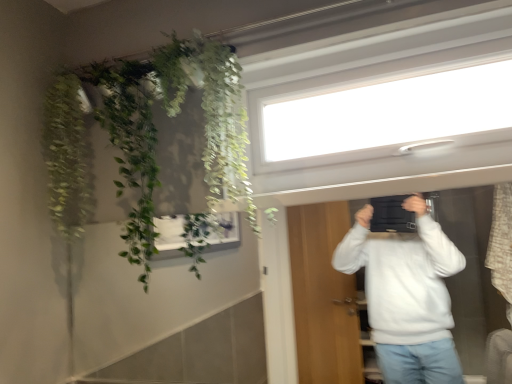
What do you see at coordinates (131, 146) in the screenshot?
I see `green leafy plant at upper left, the second plant when ordered from left to right` at bounding box center [131, 146].

Locate an element on the screen. This screenshot has width=512, height=384. green leafy plant at upper left, the first plant viewed from the right is located at coordinates (131, 146).

Image resolution: width=512 pixels, height=384 pixels. I want to click on transparent glass window at upper center, so click(381, 112).

This screenshot has height=384, width=512. Find the location of `green leafy plant at upper left, which appears as the first plant when viewed from the left`. green leafy plant at upper left, which appears as the first plant when viewed from the left is located at coordinates (67, 156).

In the scene shown: Can you tell me how much green leafy plant at upper left, acting as the second plant starting from the right, and green leafy plant at upper left, the second plant when ordered from left to right, differ in facing direction?

The angle between the facing direction of green leafy plant at upper left, acting as the second plant starting from the right, and the facing direction of green leafy plant at upper left, the second plant when ordered from left to right, is 0.000354 degrees.

Is green leafy plant at upper left, acting as the second plant starting from the right, located outside green leafy plant at upper left, the second plant when ordered from left to right?

That's correct, green leafy plant at upper left, acting as the second plant starting from the right, is outside of green leafy plant at upper left, the second plant when ordered from left to right.

Is green leafy plant at upper left, which appears as the first plant when viewed from the left, oriented towards green leafy plant at upper left, the second plant when ordered from left to right?

No, green leafy plant at upper left, which appears as the first plant when viewed from the left, is not oriented towards green leafy plant at upper left, the second plant when ordered from left to right.

Considering the relative sizes of green leafy plant at upper left, acting as the second plant starting from the right, and green leafy plant at upper left, the first plant viewed from the right, in the image provided, is green leafy plant at upper left, acting as the second plant starting from the right, smaller than green leafy plant at upper left, the first plant viewed from the right,?

Yes.

Considering the positions of objects transparent glass window at upper center and green leafy plant at upper left, acting as the second plant starting from the right, in the image provided, who is more to the right, transparent glass window at upper center or green leafy plant at upper left, acting as the second plant starting from the right,?

From the viewer's perspective, transparent glass window at upper center appears more on the right side.

How much distance is there between transparent glass window at upper center and green leafy plant at upper left, acting as the second plant starting from the right?

They are 30.70 inches apart.

Which object is further away from the camera taking this photo, transparent glass window at upper center or green leafy plant at upper left, which appears as the first plant when viewed from the left?

Positioned behind is green leafy plant at upper left, which appears as the first plant when viewed from the left.

Between green leafy plant at upper left, the second plant when ordered from left to right, and transparent glass window at upper center, which one appears on the right side from the viewer's perspective?

transparent glass window at upper center is more to the right.

Is transparent glass window at upper center at the back of green leafy plant at upper left, the second plant when ordered from left to right?

No, green leafy plant at upper left, the second plant when ordered from left to right, is not facing the opposite direction of transparent glass window at upper center.

From a real-world perspective, between green leafy plant at upper left, the second plant when ordered from left to right, and green leafy plant at upper left, which appears as the first plant when viewed from the left, who is vertically lower?

In real-world perspective, green leafy plant at upper left, the second plant when ordered from left to right, is lower.

Looking at this image, can you tell me how much green leafy plant at upper left, the first plant viewed from the right, and green leafy plant at upper left, which appears as the first plant when viewed from the left, differ in facing direction?

0.000354 degrees separate the facing orientations of green leafy plant at upper left, the first plant viewed from the right, and green leafy plant at upper left, which appears as the first plant when viewed from the left.

Is the position of green leafy plant at upper left, the first plant viewed from the right, more distant than that of green leafy plant at upper left, acting as the second plant starting from the right?

That is False.

Is point (137, 174) closer to camera compared to point (53, 90)?

That is True.

Is transparent glass window at upper center at the back of green leafy plant at upper left, acting as the second plant starting from the right?

No, green leafy plant at upper left, acting as the second plant starting from the right, is not facing the opposite direction of transparent glass window at upper center.

Does green leafy plant at upper left, which appears as the first plant when viewed from the left, appear on the right side of transparent glass window at upper center?

In fact, green leafy plant at upper left, which appears as the first plant when viewed from the left, is to the left of transparent glass window at upper center.

Can you confirm if green leafy plant at upper left, which appears as the first plant when viewed from the left, is smaller than transparent glass window at upper center?

Yes.

Is green leafy plant at upper left, which appears as the first plant when viewed from the left, far from transparent glass window at upper center?

No, there isn't a large distance between green leafy plant at upper left, which appears as the first plant when viewed from the left, and transparent glass window at upper center.

From a real-world perspective, who is located lower, transparent glass window at upper center or green leafy plant at upper left, the second plant when ordered from left to right?

In real-world perspective, green leafy plant at upper left, the second plant when ordered from left to right, is lower.

Does transparent glass window at upper center come behind green leafy plant at upper left, the first plant viewed from the right?

No.

Consider the image. How many degrees apart are the facing directions of transparent glass window at upper center and green leafy plant at upper left, the second plant when ordered from left to right?

They differ by 1.14 degrees in their facing directions.

From the image's perspective, between transparent glass window at upper center and green leafy plant at upper left, the second plant when ordered from left to right, who is located below?

green leafy plant at upper left, the second plant when ordered from left to right, appears lower in the image.

Find the location of a particular element. This screenshot has height=384, width=512. plant in front of the green leafy plant at upper left, acting as the second plant starting from the right is located at coordinates (131, 146).

Where is `window to the right of green leafy plant at upper left, which appears as the first plant when viewed from the left`? window to the right of green leafy plant at upper left, which appears as the first plant when viewed from the left is located at coordinates (381, 112).

Looking at the image, which one is located closer to green leafy plant at upper left, the first plant viewed from the right, green leafy plant at upper left, acting as the second plant starting from the right, or transparent glass window at upper center?

green leafy plant at upper left, acting as the second plant starting from the right, is positioned closer to the anchor green leafy plant at upper left, the first plant viewed from the right.

Based on their spatial positions, is green leafy plant at upper left, the first plant viewed from the right, or transparent glass window at upper center closer to green leafy plant at upper left, which appears as the first plant when viewed from the left?

The object closer to green leafy plant at upper left, which appears as the first plant when viewed from the left, is green leafy plant at upper left, the first plant viewed from the right.

When comparing their distances from green leafy plant at upper left, acting as the second plant starting from the right, does transparent glass window at upper center or green leafy plant at upper left, the second plant when ordered from left to right, seem closer?

Among the two, green leafy plant at upper left, the second plant when ordered from left to right, is located nearer to green leafy plant at upper left, acting as the second plant starting from the right.

Looking at the image, which one is located closer to transparent glass window at upper center, green leafy plant at upper left, acting as the second plant starting from the right, or green leafy plant at upper left, the second plant when ordered from left to right?

green leafy plant at upper left, the second plant when ordered from left to right.

From the image, which object appears to be nearer to green leafy plant at upper left, the first plant viewed from the right, transparent glass window at upper center or green leafy plant at upper left, acting as the second plant starting from the right?

Based on the image, green leafy plant at upper left, acting as the second plant starting from the right, appears to be nearer to green leafy plant at upper left, the first plant viewed from the right.

Estimate the real-world distances between objects in this image. Which object is further from transparent glass window at upper center, green leafy plant at upper left, the second plant when ordered from left to right, or green leafy plant at upper left, which appears as the first plant when viewed from the left?

green leafy plant at upper left, which appears as the first plant when viewed from the left, is further to transparent glass window at upper center.

Locate an element on the screen. plant between green leafy plant at upper left, which appears as the first plant when viewed from the left, and transparent glass window at upper center from left to right is located at coordinates (131, 146).